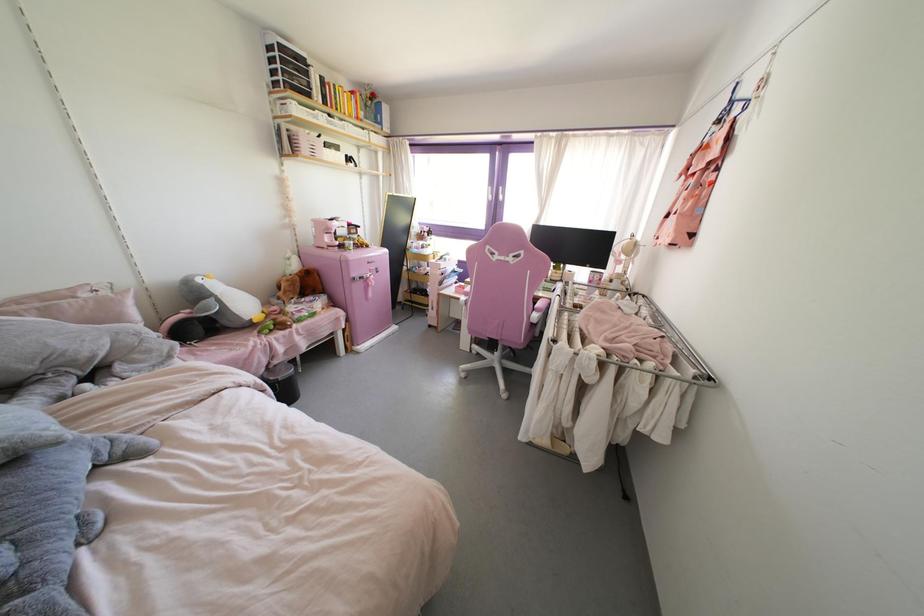
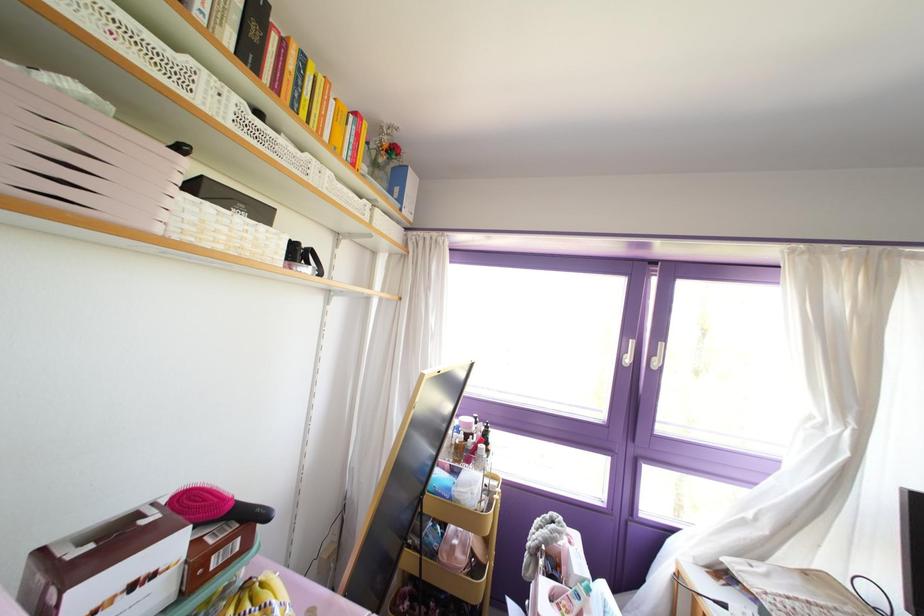
Where in the second image is the point corresponding to pixel 489 197 from the first image?

(626, 360)